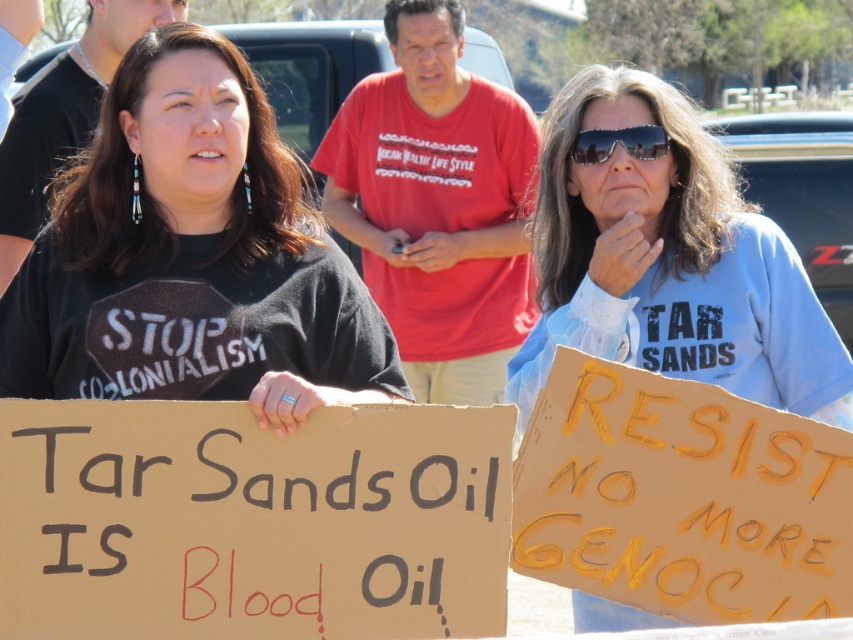
You are a photographer at the protest scene. You need to capture a clear photo of both the yellow cardboard sign at center and the sunglasses at center. Which object should you focus on first to ensure it appears sharp in the photo?

The yellow cardboard sign at center is larger in size than sunglasses at center, so focusing on the yellow cardboard sign at center first will ensure it appears sharp, and the sunglasses at center may also be in focus due to the depth of field.

You are a photographer trying to capture a closeup of both the brown cardboard sign at center and the yellow cardboard sign at center in the protest scene. Your camera has a maximum focus range of 25 inches. Can you fit both signs into your shot without moving the camera?

The distance between the brown cardboard sign at center and the yellow cardboard sign at center is 24.74 inches, which is within the camera maximum focus range of 25 inches. Yes, you can fit both signs into your shot without moving the camera.

You are a journalist taking photos of the protest. You need to describe the spatial relationship between the blue cotton shirt at center and the yellow cardboard sign at center. Which object is positioned to the left?

The blue cotton shirt at center is positioned to the left of the yellow cardboard sign at center.